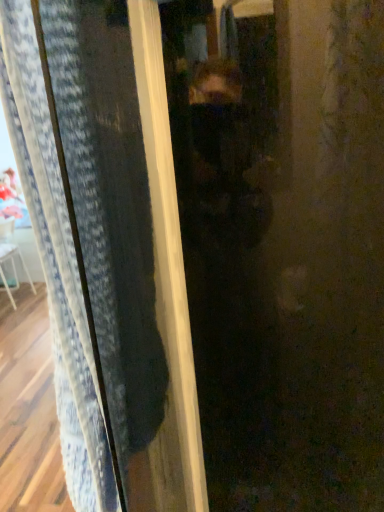
Measure the distance between transparent plastic screen door at center and camera.

The depth of transparent plastic screen door at center is 11.66 inches.

In order to click on transparent plastic screen door at center in this screenshot , I will do `click(130, 241)`.

This screenshot has height=512, width=384. What do you see at coordinates (130, 241) in the screenshot? I see `transparent plastic screen door at center` at bounding box center [130, 241].

The width and height of the screenshot is (384, 512). I want to click on white fabric armchair at left, so click(x=11, y=258).

What do you see at coordinates (11, 258) in the screenshot? I see `white fabric armchair at left` at bounding box center [11, 258].

In order to face white fabric armchair at left, should I rotate leftwards or rightwards?

Rotate left and turn 23.889 degrees.

Find the location of a particular element. transparent plastic screen door at center is located at coordinates (130, 241).

Visually, is white fabric armchair at left positioned to the left or to the right of transparent plastic screen door at center?

Based on their positions, white fabric armchair at left is located to the left of transparent plastic screen door at center.

Is white fabric armchair at left further to the viewer compared to transparent plastic screen door at center?

Yes, it is.

Which is behind, point (8, 231) or point (185, 316)?

Positioned behind is point (8, 231).

From the image's perspective, relative to transparent plastic screen door at center, is white fabric armchair at left above or below?

Based on their image positions, white fabric armchair at left is located beneath transparent plastic screen door at center.

From a real-world perspective, which is physically above, white fabric armchair at left or transparent plastic screen door at center?

transparent plastic screen door at center.

Considering the sizes of white fabric armchair at left and transparent plastic screen door at center in the image, is white fabric armchair at left wider or thinner than transparent plastic screen door at center?

white fabric armchair at left is wider than transparent plastic screen door at center.

Looking at this image, considering the sizes of objects white fabric armchair at left and transparent plastic screen door at center in the image provided, who is taller, white fabric armchair at left or transparent plastic screen door at center?

white fabric armchair at left is taller.

Looking at the image, does white fabric armchair at left seem bigger or smaller compared to transparent plastic screen door at center?

white fabric armchair at left is bigger than transparent plastic screen door at center.

Is white fabric armchair at left outside of transparent plastic screen door at center?

That's correct, white fabric armchair at left is outside of transparent plastic screen door at center.

Is white fabric armchair at left with transparent plastic screen door at center?

They are not placed beside each other.

Is white fabric armchair at left aimed at transparent plastic screen door at center?

No, white fabric armchair at left does not turn towards transparent plastic screen door at center.

How many degrees apart are the facing directions of white fabric armchair at left and transparent plastic screen door at center?

5.55 degrees.

Identify the location of screen door above the white fabric armchair at left (from a real-world perspective). tap(130, 241).

Can you confirm if transparent plastic screen door at center is positioned to the right of white fabric armchair at left?

Yes.

Based on the photo, which object is further away from the camera, transparent plastic screen door at center or white fabric armchair at left?

white fabric armchair at left.

Which is less distant, (148, 497) or (8, 254)?

Point (148, 497) is closer to the camera than point (8, 254).

From the image's perspective, is transparent plastic screen door at center on top of white fabric armchair at left?

Correct, transparent plastic screen door at center appears higher than white fabric armchair at left in the image.

From the picture: From a real-world perspective, is transparent plastic screen door at center positioned above or below white fabric armchair at left?

transparent plastic screen door at center is situated higher than white fabric armchair at left in the real world.

In terms of width, does transparent plastic screen door at center look wider or thinner when compared to white fabric armchair at left?

transparent plastic screen door at center is thinner than white fabric armchair at left.

Is transparent plastic screen door at center taller than white fabric armchair at left?

Incorrect, the height of transparent plastic screen door at center is not larger of that of white fabric armchair at left.

Looking at the image, does transparent plastic screen door at center seem bigger or smaller compared to white fabric armchair at left?

transparent plastic screen door at center is smaller than white fabric armchair at left.

Can white fabric armchair at left be found inside transparent plastic screen door at center?

No.

Is transparent plastic screen door at center not near white fabric armchair at left?

Indeed, transparent plastic screen door at center is not near white fabric armchair at left.

Is transparent plastic screen door at center aimed at white fabric armchair at left?

No, transparent plastic screen door at center is not turned towards white fabric armchair at left.

In the scene shown: What's the angular difference between transparent plastic screen door at center and white fabric armchair at left's facing directions?

They differ by 5.55 degrees in their facing directions.

What are the coordinates of `screen door above the white fabric armchair at left (from a real-world perspective)` in the screenshot? It's located at [130, 241].

In order to click on screen door that appears in front of the white fabric armchair at left in this screenshot , I will do `click(130, 241)`.

Locate an element on the screen. The height and width of the screenshot is (512, 384). armchair behind the transparent plastic screen door at center is located at coordinates (11, 258).